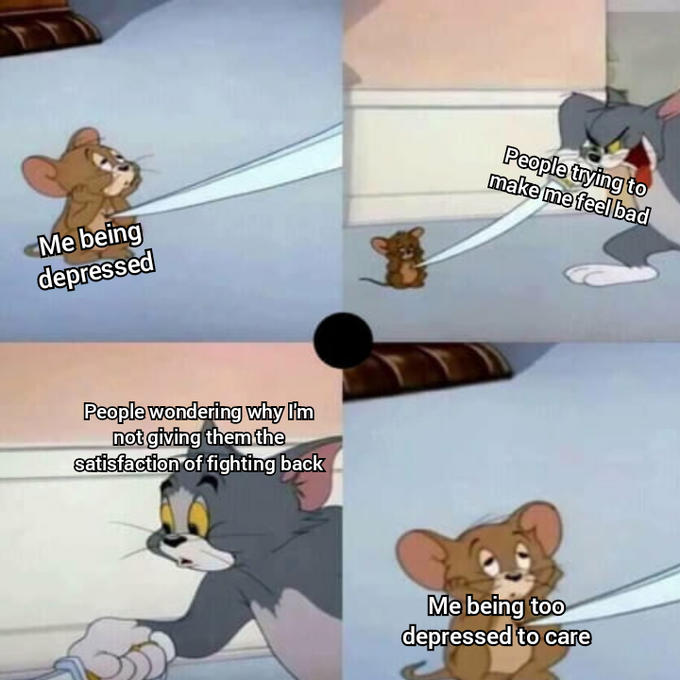
You are a GUI agent. You are given a task and a screenshot of the screen. Output one action in this format:
    pyautogui.click(x=<x>, y=<y>)
    Task: Click on the panel
    This screenshot has width=680, height=680.
    Given the screenshot: What is the action you would take?
    pyautogui.click(x=528, y=473), pyautogui.click(x=313, y=391), pyautogui.click(x=290, y=290), pyautogui.click(x=418, y=292)